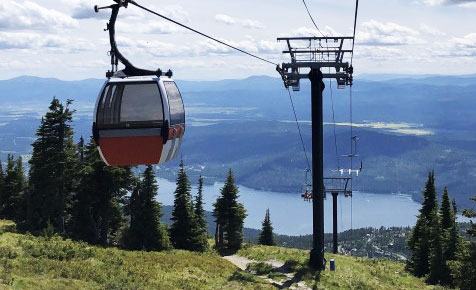
This screenshot has width=476, height=290. Identify the location of window. click(x=142, y=110).